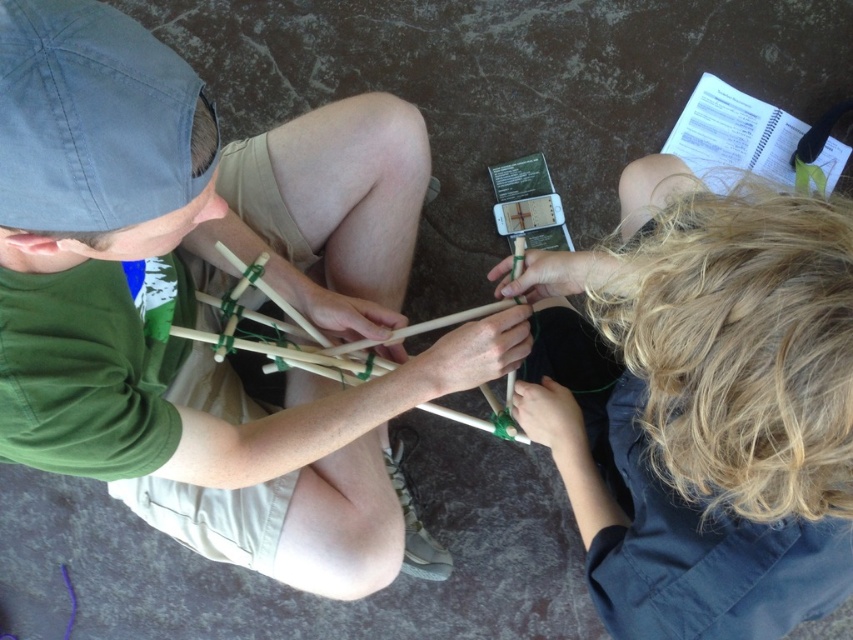
Question: Which point appears farthest from the camera in this image?

Choices:
 (A) (813, 467)
 (B) (393, 497)

Answer: (B)

Question: Does smooth wooden sticks at center have a lesser width compared to blonde hair at upper right?

Choices:
 (A) yes
 (B) no

Answer: (B)

Question: Among these points, which one is nearest to the camera?

Choices:
 (A) (756, 365)
 (B) (149, 346)

Answer: (A)

Question: From the image, what is the correct spatial relationship of smooth wooden sticks at center in relation to blonde hair at upper right?

Choices:
 (A) left
 (B) right

Answer: (A)

Question: Is smooth wooden sticks at center bigger than blonde hair at upper right?

Choices:
 (A) yes
 (B) no

Answer: (A)